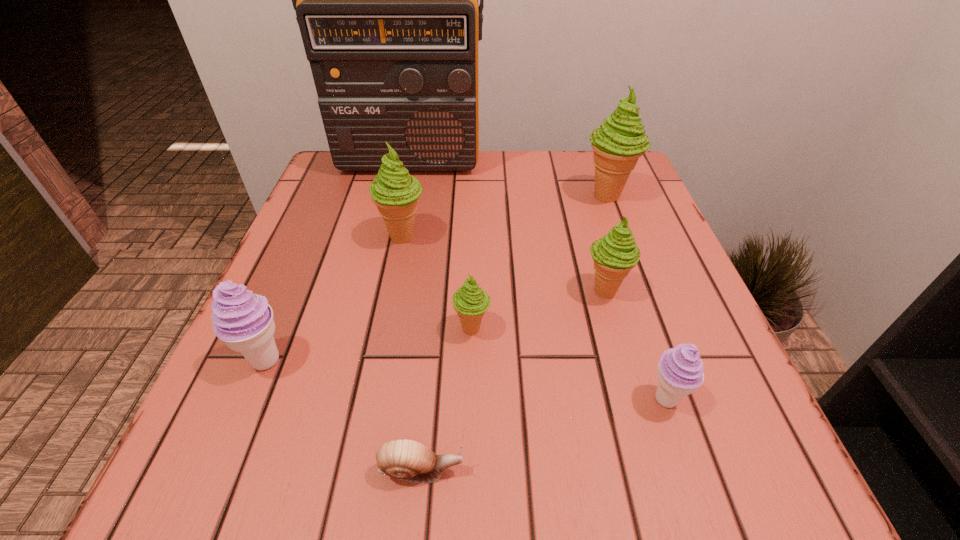
At what (x,y) coordinates should I click in order to perform the action: click on vacant position in the image that satisfies the following two spatial constraints: 1. on the front-facing side of the farthest object; 2. on the right side of the biggest green icecream. Please return your answer as a coordinate pair (x, y). This screenshot has width=960, height=540. Looking at the image, I should click on (401, 195).

Locate an element on the screen. The width and height of the screenshot is (960, 540). free space that satisfies the following two spatial constraints: 1. on the back side of the right purple icecream; 2. on the right side of the farthest icecream is located at coordinates [596, 195].

At what (x,y) coordinates should I click in order to perform the action: click on free point that satisfies the following two spatial constraints: 1. on the front-facing side of the farthest object; 2. on the left side of the seventh nearest object. Please return your answer as a coordinate pair (x, y). Image resolution: width=960 pixels, height=540 pixels. Looking at the image, I should click on (401, 195).